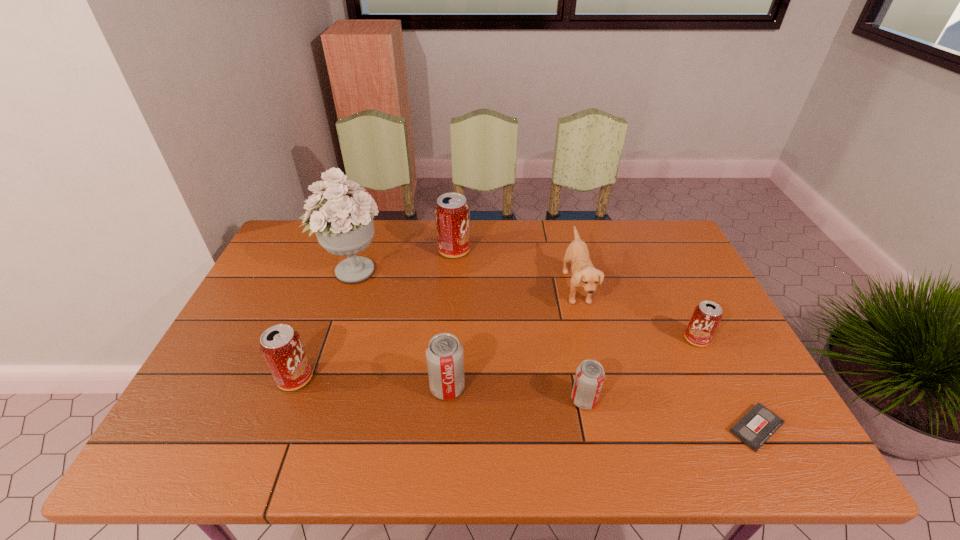
Find the location of a particular element. object situated at the far left corner is located at coordinates (344, 226).

What are the coordinates of `object positioned at the near right corner` in the screenshot? It's located at (759, 423).

In the image, there is a desktop. Where is `blank space at the far edge`? The image size is (960, 540). blank space at the far edge is located at coordinates (444, 262).

The height and width of the screenshot is (540, 960). What are the coordinates of `free space at the near edge of the desktop` in the screenshot? It's located at (543, 464).

You are a GUI agent. You are given a task and a screenshot of the screen. Output one action in this format:
    pyautogui.click(x=<x>, y=<y>)
    Task: Click on the free space at the right edge of the desktop
    This screenshot has height=540, width=960.
    Given the screenshot: What is the action you would take?
    pyautogui.click(x=711, y=340)

In the image, there is a desktop. Where is `blank space at the far left corner`? The image size is (960, 540). blank space at the far left corner is located at coordinates (294, 230).

Image resolution: width=960 pixels, height=540 pixels. Find the location of `free space between the fifth nearest object and the bouquet`. free space between the fifth nearest object and the bouquet is located at coordinates (524, 305).

The image size is (960, 540). Identify the location of free space between the bigger gray soda can and the bouquet. [x=399, y=329].

Locate an element on the screen. This screenshot has width=960, height=540. vacant space in between the bigger gray soda can and the fifth nearest object is located at coordinates (572, 363).

What are the coordinates of `free area in between the rightmost soda can and the videotape` in the screenshot? It's located at (727, 383).